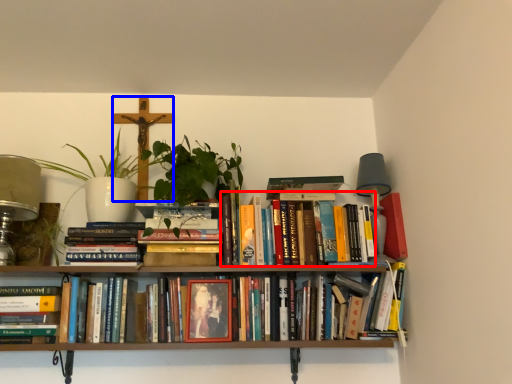
Question: Which object appears farthest to the camera in this image, book (highlighted by a red box) or crucifix (highlighted by a blue box)?

Choices:
 (A) book
 (B) crucifix

Answer: (B)